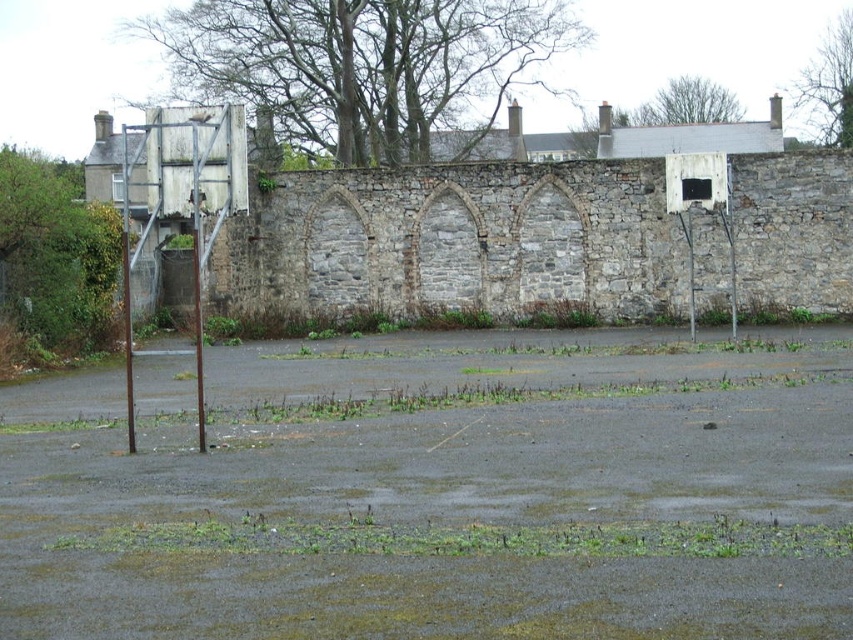
You are planning to install a basketball hoop in your backyard and want to choose between the metallic gray basketball hoop at left and the white painted metal basketball hoop at right based on size. Which one should you choose if you need a larger hoop?

You should choose the metallic gray basketball hoop at left because it has a larger size compared to the white painted metal basketball hoop at right.

You are standing in front of the weathered stone wall with arched openings. You see the metallic gray basketball hoop at left and the white painted metal basketball hoop at right. Which basketball hoop is positioned more to the east side of the paved area?

The metallic gray basketball hoop at left is positioned more to the east side of the paved area because it is to the left of the white painted metal basketball hoop at right, and since the image is viewed from a standard perspective, left typically corresponds to the east direction.